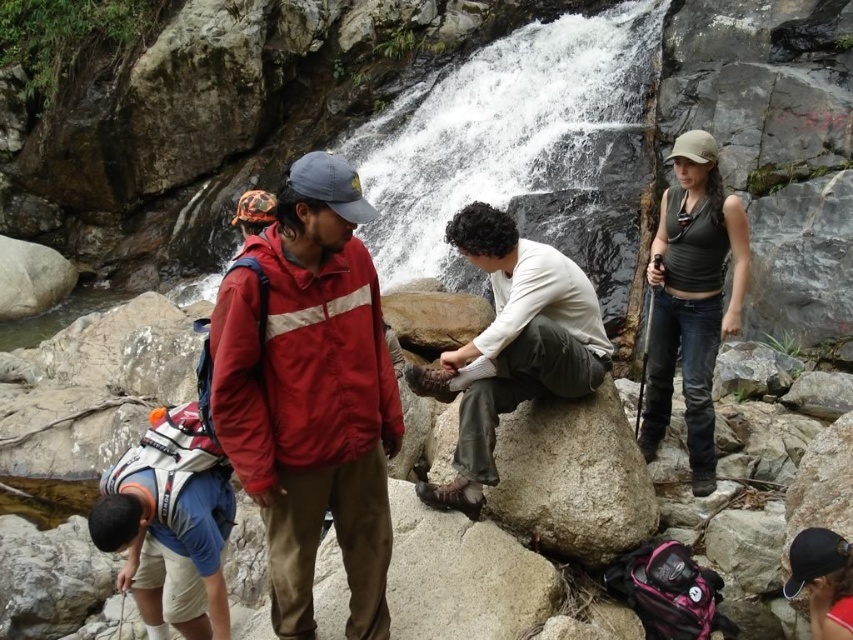
Question: Which point is farther to the camera?

Choices:
 (A) matte red jacket at center
 (B) white matte shirt at center
 (C) matte green tank top at right

Answer: (C)

Question: Considering the real-world distances, which object is closest to the white matte shirt at center?

Choices:
 (A) matte green tank top at right
 (B) matte red jacket at center

Answer: (A)

Question: Is white matte shirt at center wider than matte green tank top at right?

Choices:
 (A) yes
 (B) no

Answer: (A)

Question: Does matte red jacket at center appear under matte green tank top at right?

Choices:
 (A) yes
 (B) no

Answer: (A)

Question: Among these objects, which one is nearest to the camera?

Choices:
 (A) matte red jacket at center
 (B) matte green tank top at right
 (C) white matte shirt at center

Answer: (A)

Question: Is matte red jacket at center smaller than white matte shirt at center?

Choices:
 (A) no
 (B) yes

Answer: (A)